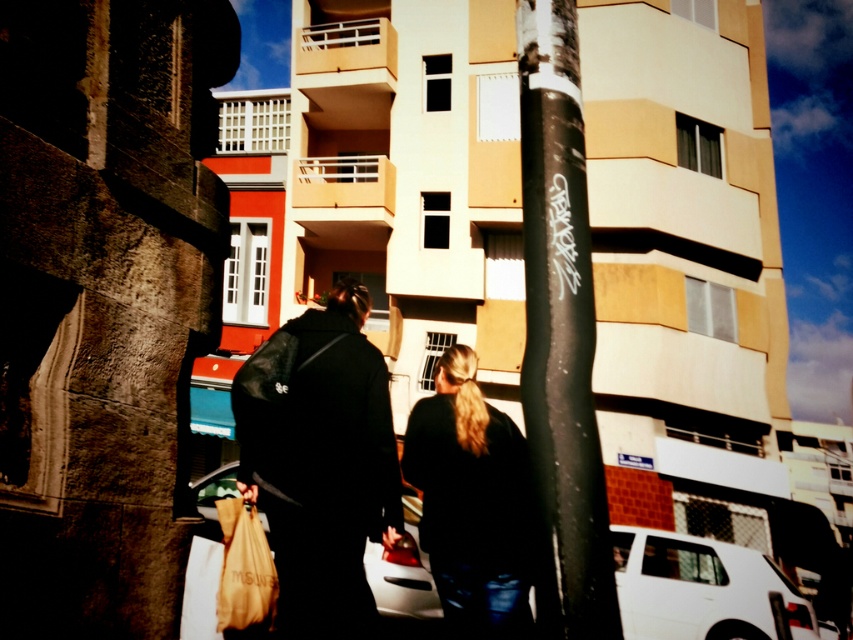
You are a fashion designer observing two jackets in a street scene. You see the black leather jacket at center and the black matte jacket at center. Which one is positioned more to the left?

The black leather jacket at center is positioned more to the left than the black matte jacket at center.

You are a delivery person who needs to place a package on the black matte pole at center. However, there is a matte brown paper bag at lower left in the way. Based on their positions, can you determine which object is closer to the camera?

The black matte pole at center is positioned on the right side of the matte brown paper bag at lower left, meaning the matte brown paper bag at lower left is closer to the camera than the black matte pole at center.

You are a photographer standing on the sidewalk. You want to take a photo of the black leather jacket at center without including the black matte pole at center in the frame. Is it possible to do so by adjusting your camera angle?

The black matte pole at center is located above the black leather jacket at center, so yes, you can lower your camera angle to exclude the pole while still capturing the jacket.